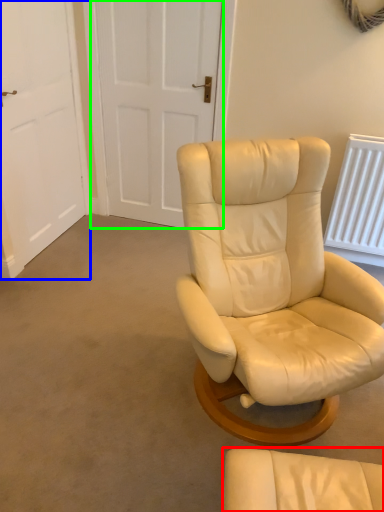
Question: Based on their relative distances, which object is farther from chair (highlighted by a red box)? Choose from door (highlighted by a blue box) and door (highlighted by a green box).

Choices:
 (A) door
 (B) door

Answer: (B)